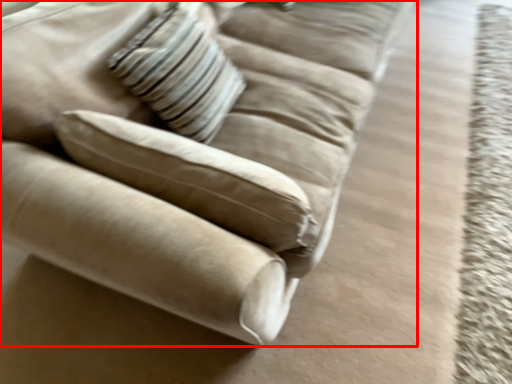
Question: Considering the relative positions of studio couch (annotated by the red box) and pillow in the image provided, where is studio couch (annotated by the red box) located with respect to the staircase?

Choices:
 (A) right
 (B) left

Answer: (A)